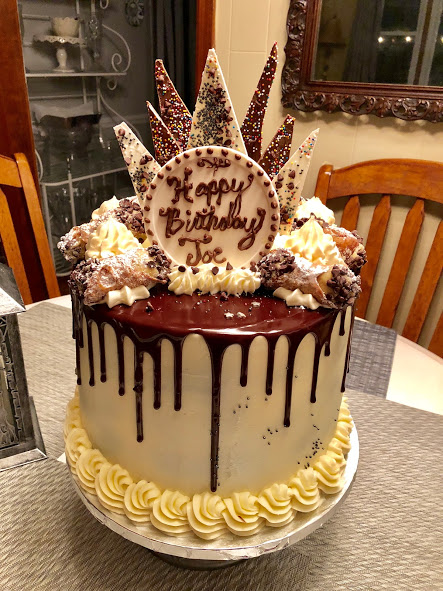
Locate an element on the screen. clear glass pedestal is located at coordinates (195, 565).